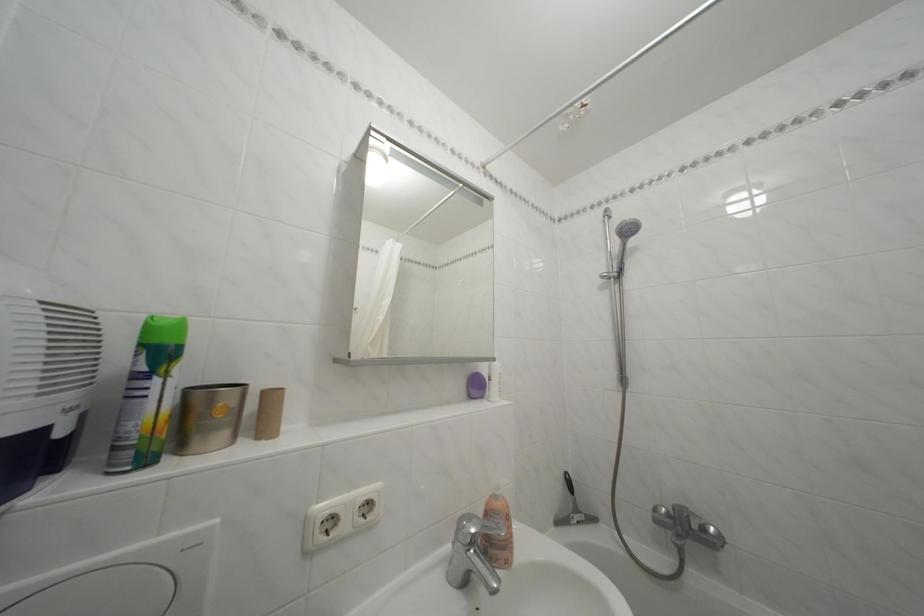
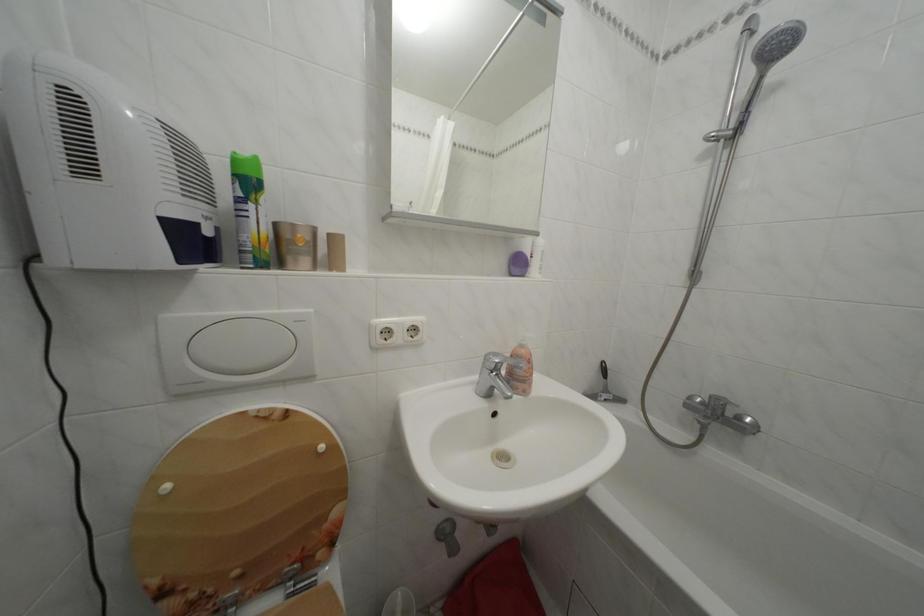
The point at [485,392] is marked in the first image. Where is the corresponding point in the second image?

(527, 270)